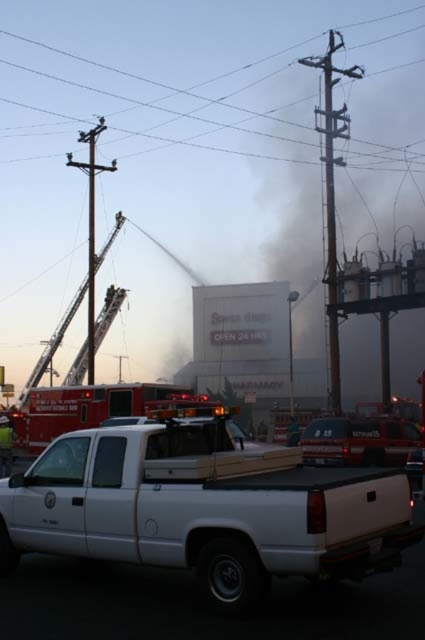
Question: Among these points, which one is nearest to the camera?

Choices:
 (A) (2, 460)
 (B) (181, 493)
 (C) (158, 394)
 (D) (289, 65)

Answer: (B)

Question: Can you confirm if white matte truck bed at lower center is positioned to the left of reddish-orange metallic fire truck at left?

Choices:
 (A) yes
 (B) no

Answer: (B)

Question: Which point is farther from the camera taking this photo?

Choices:
 (A) (255, 131)
 (B) (13, 445)
 (C) (136, 385)

Answer: (A)

Question: Is white matte truck bed at lower center wider than red uniform fireman at center?

Choices:
 (A) yes
 (B) no

Answer: (A)

Question: Is white matte truck bed at lower center positioned behind reddish-orange metallic fire truck at left?

Choices:
 (A) yes
 (B) no

Answer: (B)

Question: Which object appears farthest from the camera in this image?

Choices:
 (A) white matte truck bed at lower center
 (B) brown wooden pole at upper center
 (C) reddish-orange metallic fire truck at left
 (D) red uniform fireman at center

Answer: (B)